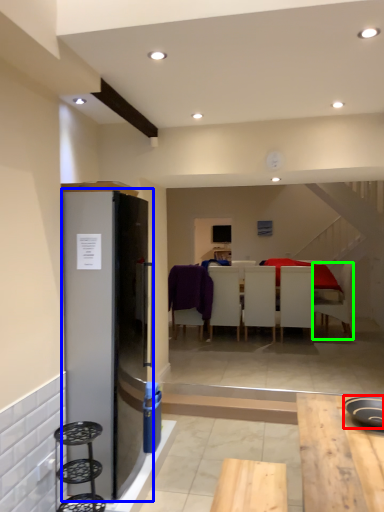
Question: Which object is positioned farthest from appliance (highlighted by a red box)? Select from fridge (highlighted by a blue box) and chair (highlighted by a green box).

Choices:
 (A) fridge
 (B) chair

Answer: (B)